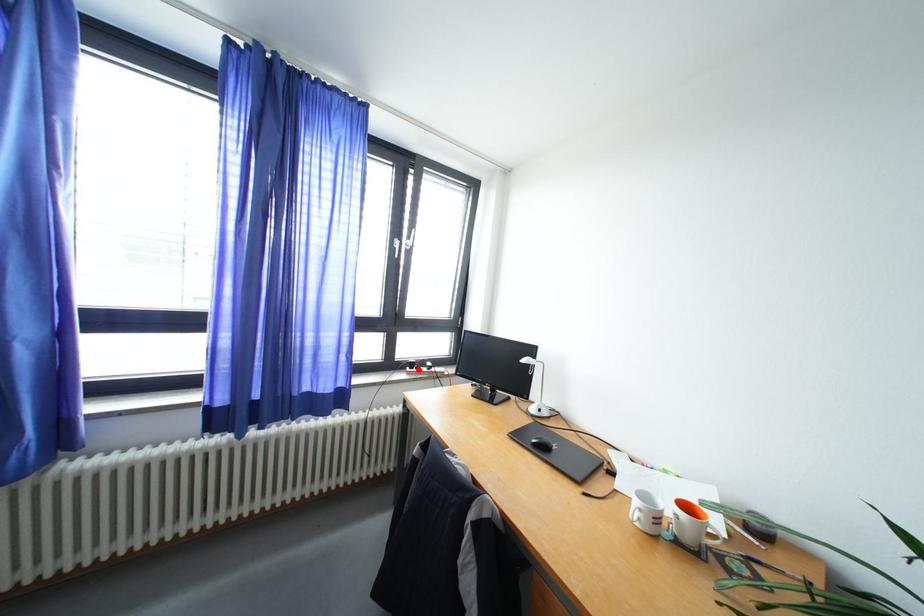
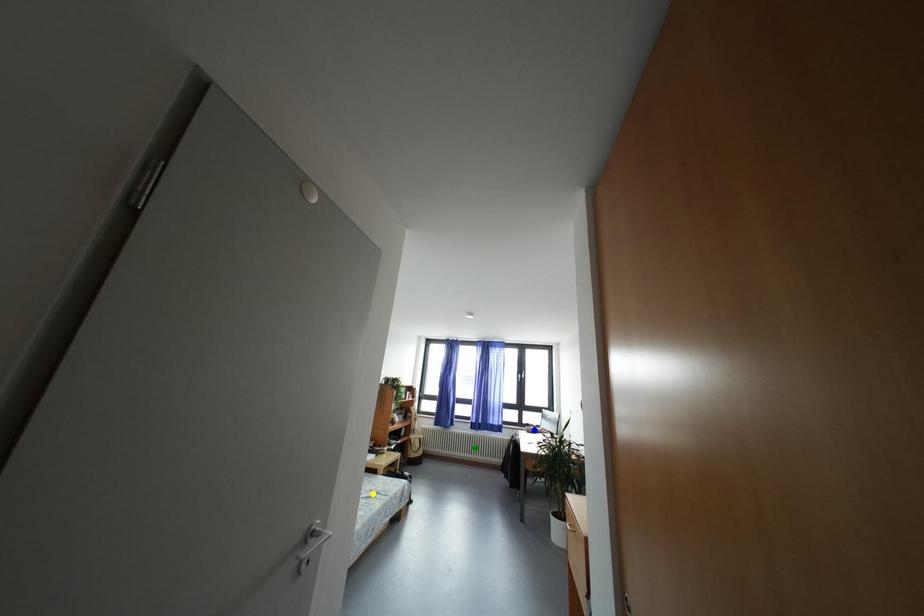
Question: I am providing you with two images of the same scene from different viewpoints. A red point is marked on the first image. You are given multiple points on the second image. Which mark in image 2 goes with the point in image 1?

Choices:
 (A) green point
 (B) yellow point
 (C) blue point

Answer: (C)